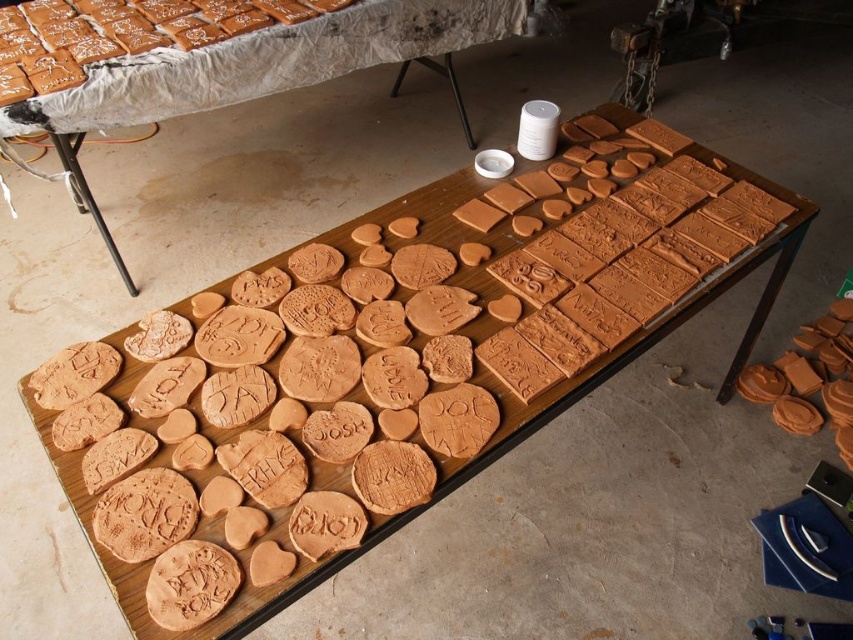
Question: Can you confirm if matte clay tiles at center is positioned to the right of white matte container at upper center?

Choices:
 (A) no
 (B) yes

Answer: (A)

Question: Can you confirm if matte clay tiles at center is bigger than matte brown gingerbread at upper left?

Choices:
 (A) yes
 (B) no

Answer: (A)

Question: Estimate the real-world distances between objects in this image. Which object is closer to the matte clay tiles at center?

Choices:
 (A) matte clay cookie at right
 (B) white matte container at upper center
 (C) matte brown gingerbread at upper left

Answer: (C)

Question: Based on their relative distances, which object is farther from the matte clay tiles at center?

Choices:
 (A) white matte container at upper center
 (B) matte clay cookie at right
 (C) matte brown gingerbread at upper left

Answer: (B)

Question: Which object appears farthest from the camera in this image?

Choices:
 (A) white matte container at upper center
 (B) matte brown gingerbread at upper left

Answer: (B)

Question: Is matte brown gingerbread at upper left further to the viewer compared to white matte container at upper center?

Choices:
 (A) yes
 (B) no

Answer: (A)